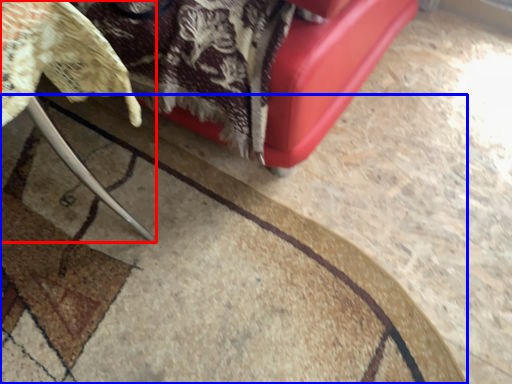
Question: Which of the following is the closest to the observer, furniture (highlighted by a red box) or mat (highlighted by a blue box)?

Choices:
 (A) furniture
 (B) mat

Answer: (A)